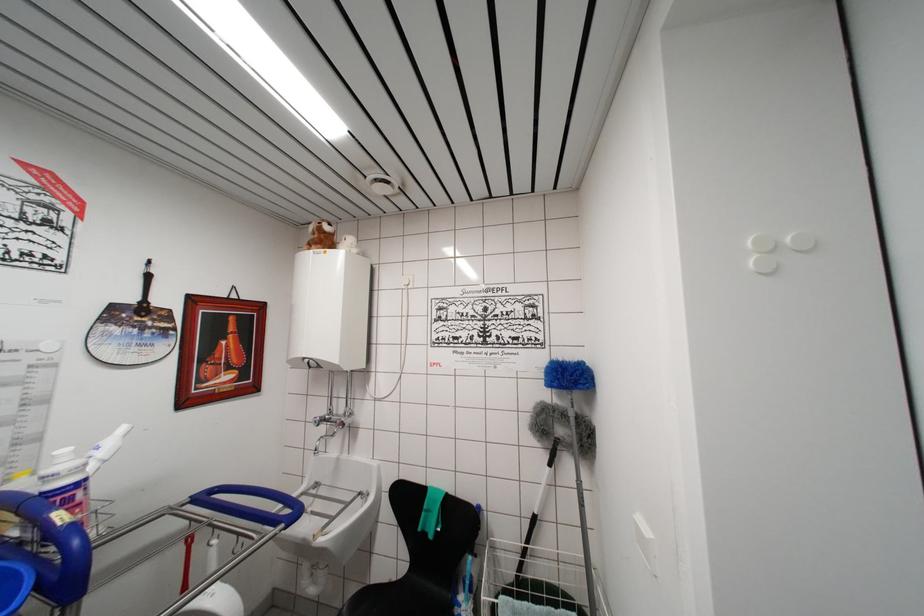
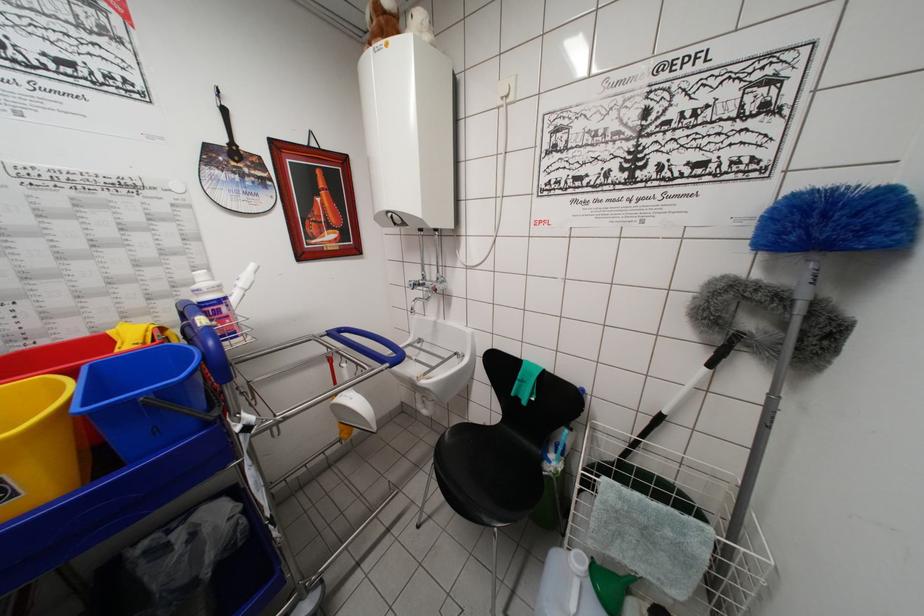
Where in the second image is the point corresponding to point 533,522 from the first image?

(658, 419)